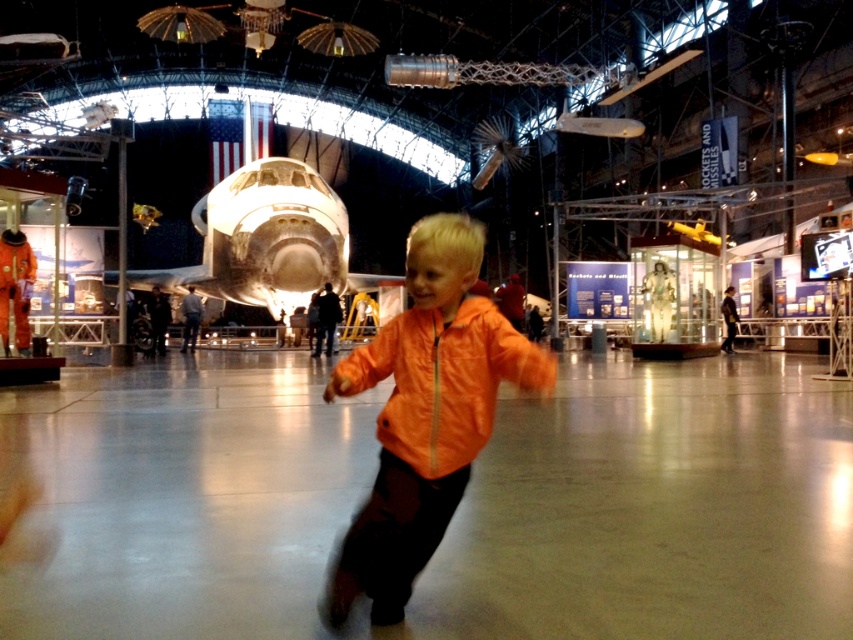
You are a photographer trying to capture the child in the orange jacket at center. You notice two jackets of the same color but different finishes. Which one is taller, the orange shiny jacket at center or the orange matte jacket at center?

The orange shiny jacket at center has a greater height compared to the orange matte jacket at center.

You are a photographer in the museum and want to capture a photo of both the orange shiny jacket at center and the orange matte jacket at center in the same frame. Which jacket should you position closer to the left side of your camera frame to ensure both are visible?

You should position the orange shiny jacket at center closer to the left side of your camera frame because it is already to the left of the orange matte jacket at center in the scene.

You are a photographer at the museum and want to capture both the orange shiny jacket at center and the orange matte jacket at center in a single photo. Since you want both jackets to appear equally prominent, which jacket should you move closer to the camera?

The orange shiny jacket at center is bigger than the orange matte jacket at center. To make them appear equally prominent in the photo, you should move the orange matte jacket at center closer to the camera so that its size in the frame matches the larger orange shiny jacket at center.